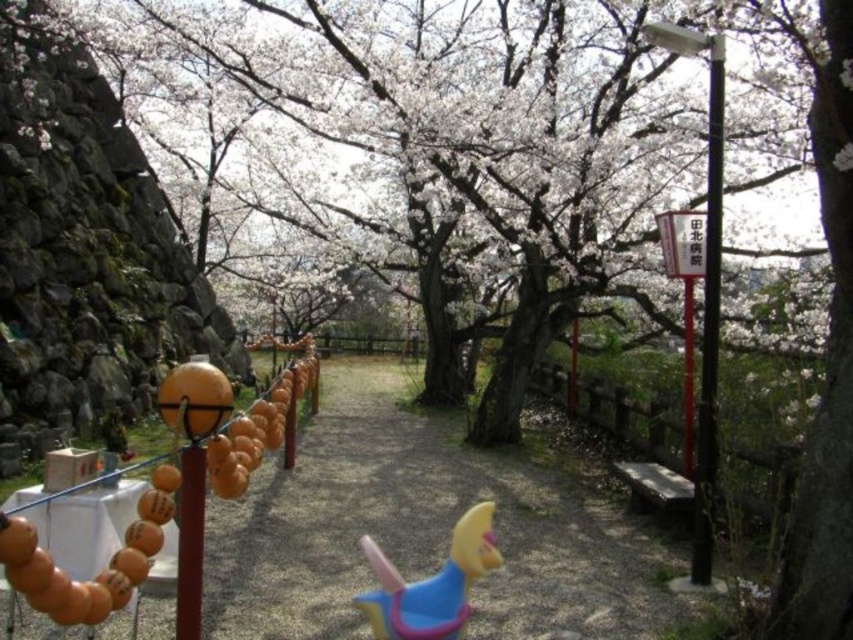
Question: Which point is farther to the camera?

Choices:
 (A) (346, 518)
 (B) (450, 576)
 (C) (577, 154)

Answer: (C)

Question: Which object is positioned closest to the brown gravel path at center?

Choices:
 (A) matte plastic toy horse at center
 (B) white blossoming tree at center

Answer: (A)

Question: Based on their relative distances, which object is farther from the brown gravel path at center?

Choices:
 (A) white blossoming tree at center
 (B) matte plastic toy horse at center

Answer: (A)

Question: Does white blossoming tree at center appear on the right side of brown gravel path at center?

Choices:
 (A) yes
 (B) no

Answer: (B)

Question: Can you confirm if white blossoming tree at center is wider than matte plastic toy horse at center?

Choices:
 (A) yes
 (B) no

Answer: (A)

Question: Does white blossoming tree at center appear on the right side of brown gravel path at center?

Choices:
 (A) yes
 (B) no

Answer: (B)